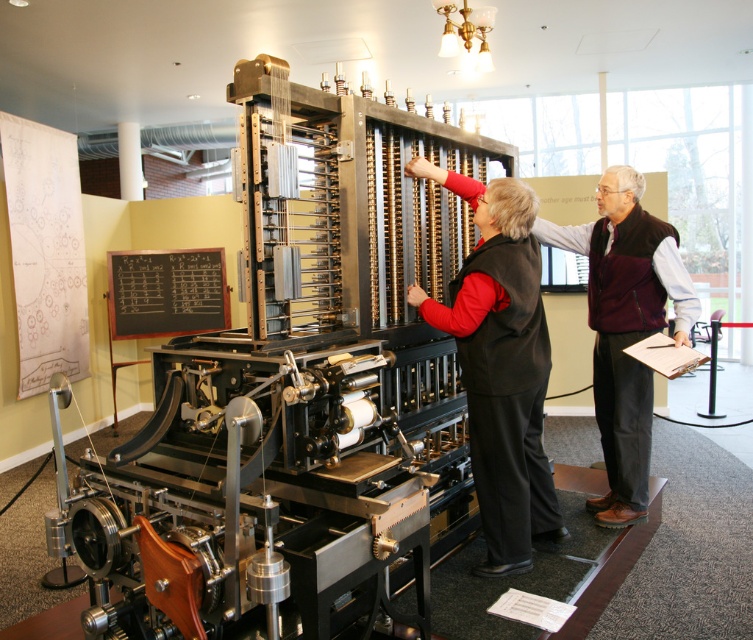
Question: Does black vest at center come in front of black chalkboard at center?

Choices:
 (A) yes
 (B) no

Answer: (A)

Question: Which object appears farthest from the camera in this image?

Choices:
 (A) black chalkboard at center
 (B) black vest at center

Answer: (A)

Question: Is black vest at center below black chalkboard at center?

Choices:
 (A) no
 (B) yes

Answer: (B)

Question: Does black vest at center have a larger size compared to black chalkboard at center?

Choices:
 (A) no
 (B) yes

Answer: (B)